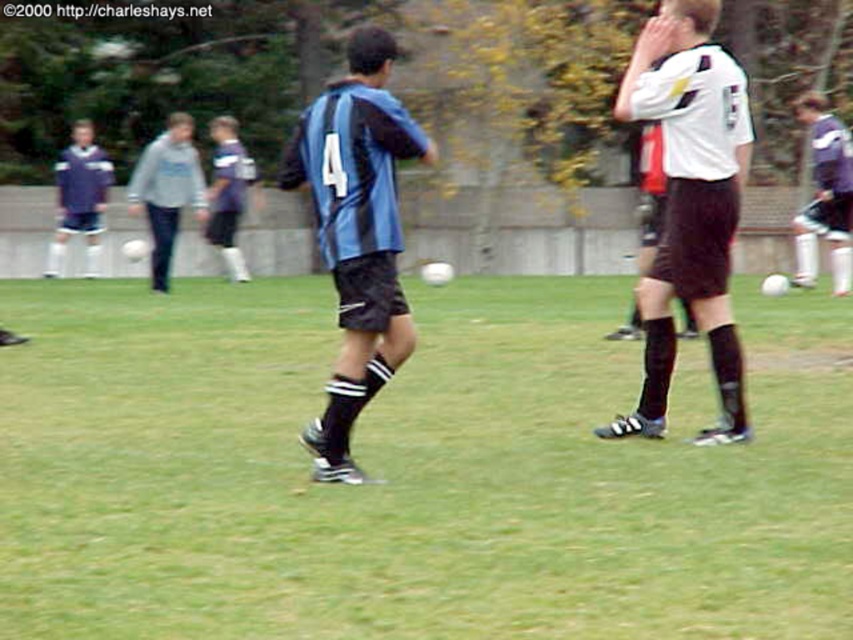
You are a soccer coach observing the game. You notice the green grass at center and the blue jersey at center. How far apart are these two elements in the image?

The green grass at center is 26.67 feet away from the blue jersey at center.